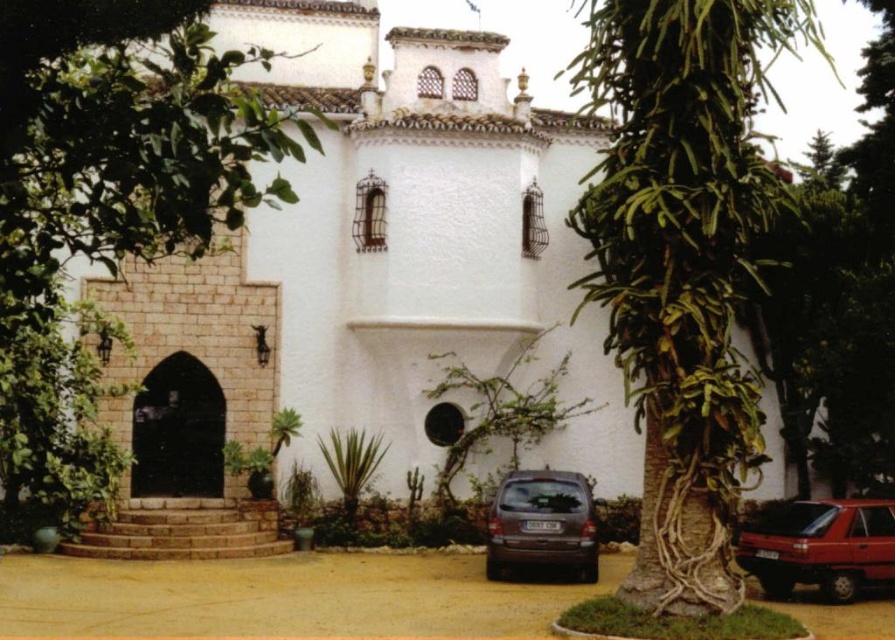
You are a delivery driver approaching the white building with a package. You see a green leafy tree at left and a satin brown minivan at lower center. Which object is closer to the building?

The satin brown minivan at lower center is closer to the building because it is positioned lower than the green leafy tree at left, which is above it.

You are standing in front of the white building with the arched entrance. There are two points marked on the building facade. The first point is at coordinates point (258, 140) and the second is at point (592, 556). Which of these points is closer to you as you face the building?

Point (258, 140) is in front of point (592, 556), so it is closer to you as you face the building.

You are standing in front of the building and want to place a small decoration between the two points, point (756, 534) and point (539, 486). Which point should the decoration be closer to in order to appear centered from your perspective?

The decoration should be closer to point (539, 486) because point (756, 534) is closer to the viewer. To appear centered, the decoration needs to compensate by being nearer to the farther point.